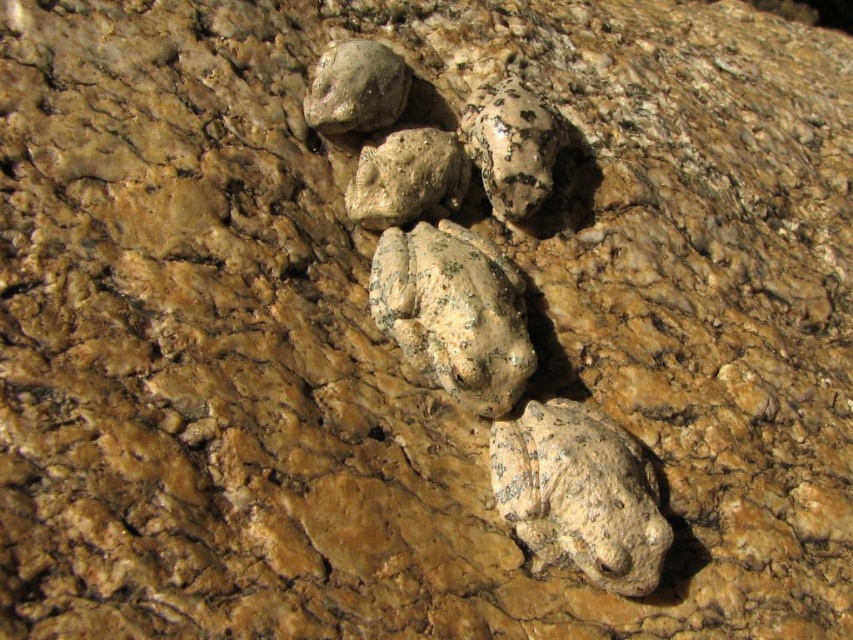
Who is lower down, speckled stone frog at center or speckled stone frog at upper center?

speckled stone frog at center

Does point (498, 300) come behind point (503, 154)?

No, (498, 300) is closer to viewer.

Locate an element on the screen. Image resolution: width=853 pixels, height=640 pixels. speckled stone frog at center is located at coordinates (453, 312).

Which is more to the left, speckled stone frog at upper center or rough textured rock at upper center?

rough textured rock at upper center

Is point (524, 160) behind point (381, 51)?

That is False.

I want to click on speckled stone frog at upper center, so click(512, 145).

Is speckled stone frog at center bigger than rough textured rock at upper center?

Yes, speckled stone frog at center is bigger than rough textured rock at upper center.

I want to click on speckled stone frog at center, so click(453, 312).

Find the location of a particular element. The image size is (853, 640). speckled stone frog at center is located at coordinates (453, 312).